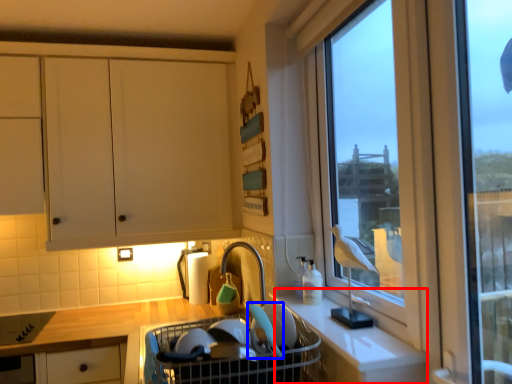
Question: Which of the following is the farthest to the observer, counter (highlighted by a red box) or appliance (highlighted by a blue box)?

Choices:
 (A) counter
 (B) appliance

Answer: (B)